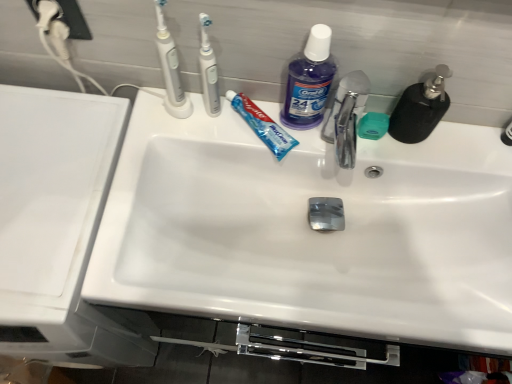
Find the location of a particular element. vacant area that lies to the right of black matte soap dispenser at upper right is located at coordinates click(x=462, y=152).